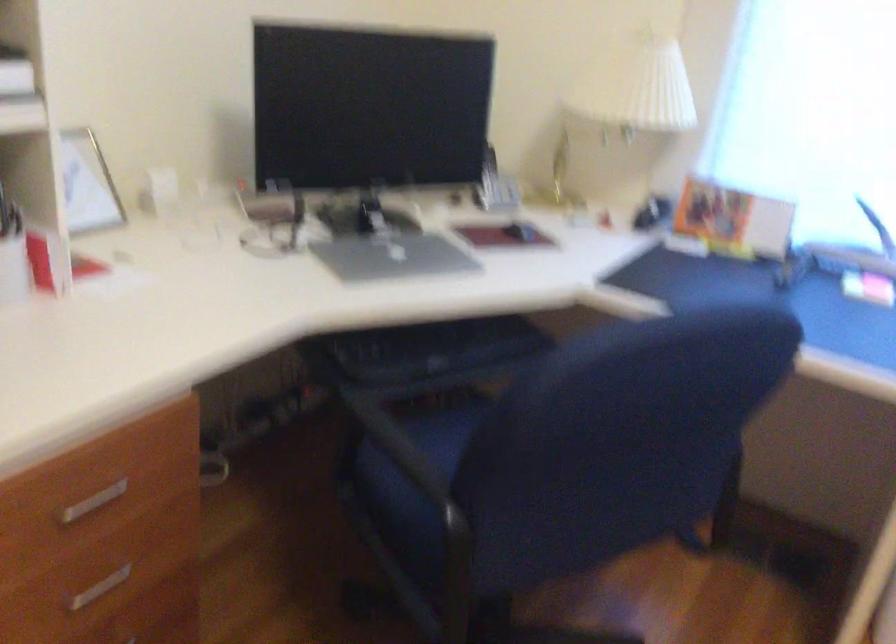
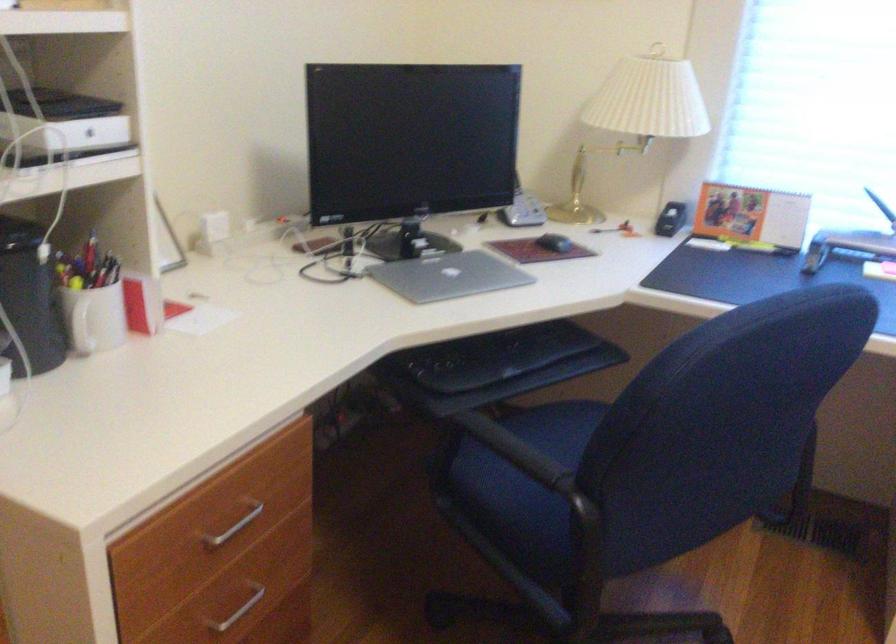
Find the pixel in the second image that matches the point at 99,502 in the first image.

(231, 527)